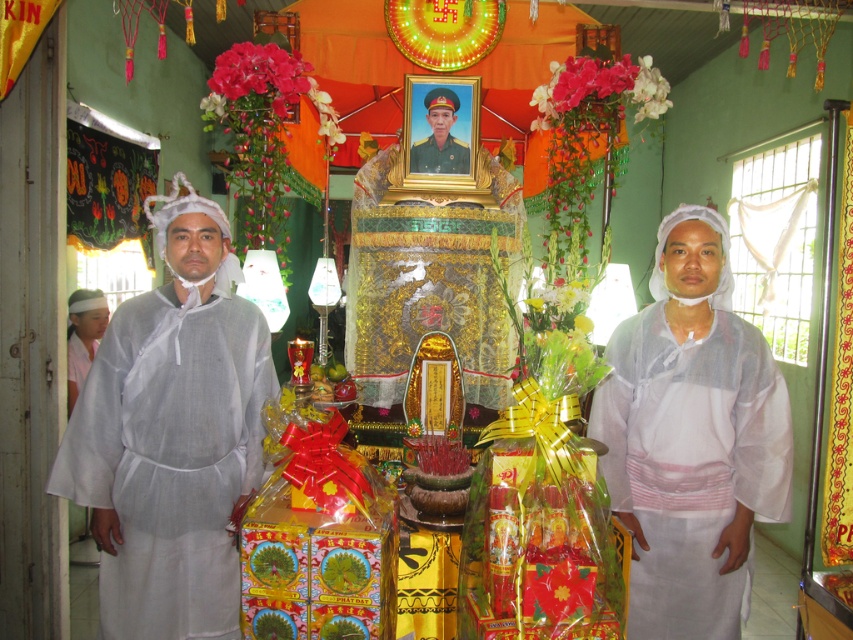
You are standing in front of the shrine and need to determine which person is taller. You see a white sheer robe at right and a green matte uniform at center. Which person is taller?

The white sheer robe at right is much taller than the green matte uniform at center, so the person wearing the white sheer robe at right is taller.

You are a visitor to this shrine and want to place an offering. The shrine has two central items, the white linen robe at center and the green matte uniform at center. Which item should you place your offering in front of if you want it closer to the ground?

The white linen robe at center is located below the green matte uniform at center, so placing your offering in front of the white linen robe at center will position it closer to the ground.

You are an observer standing in front of the shrine. You notice the white sheer robe at right and the green matte uniform at center. Which object is positioned lower in the image?

The white sheer robe at right is below the green matte uniform at center, so it is positioned lower in the image.